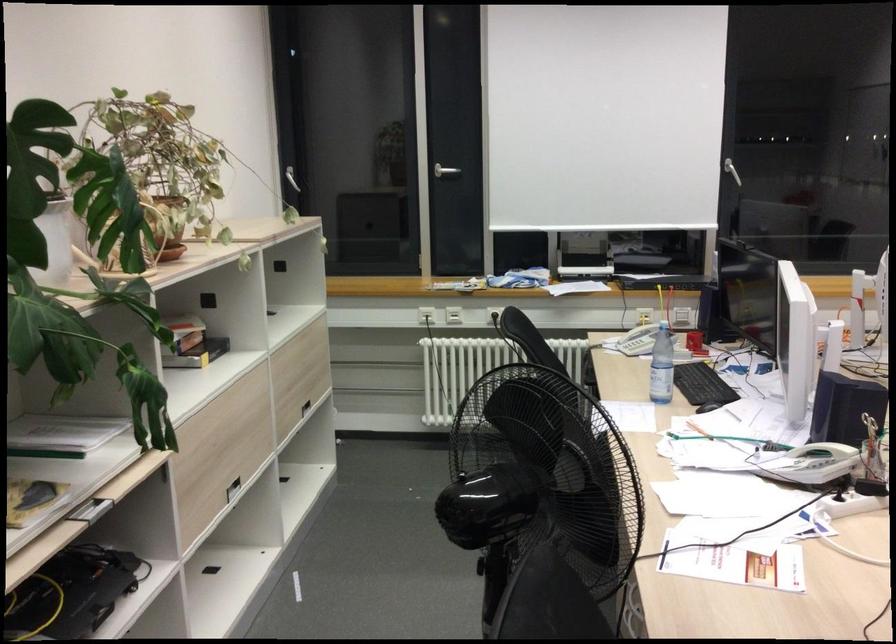
Describe the element at coordinates (731, 171) in the screenshot. I see `the white window handle` at that location.